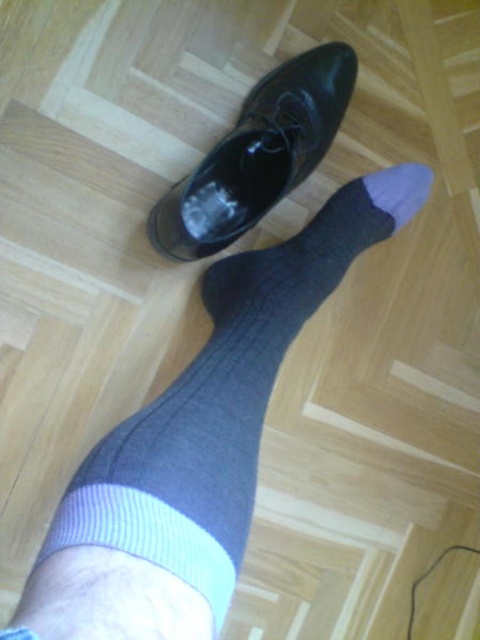
Question: Is gray ribbed sock at center wider than shiny black shoe at center?

Choices:
 (A) yes
 (B) no

Answer: (A)

Question: Considering the real-world distances, which object is farthest from the gray ribbed sock at center?

Choices:
 (A) shiny black shoe at center
 (B) gray knitted sock at center

Answer: (B)

Question: Which object is positioned closest to the shiny black shoe at center?

Choices:
 (A) gray knitted sock at center
 (B) gray ribbed sock at center

Answer: (B)

Question: Is gray ribbed sock at center positioned before shiny black shoe at center?

Choices:
 (A) yes
 (B) no

Answer: (A)

Question: Among these objects, which one is farthest from the camera?

Choices:
 (A) gray ribbed sock at center
 (B) shiny black shoe at center
 (C) gray knitted sock at center

Answer: (C)

Question: Considering the relative positions of shiny black shoe at center and gray knitted sock at center in the image provided, where is shiny black shoe at center located with respect to gray knitted sock at center?

Choices:
 (A) left
 (B) right

Answer: (A)